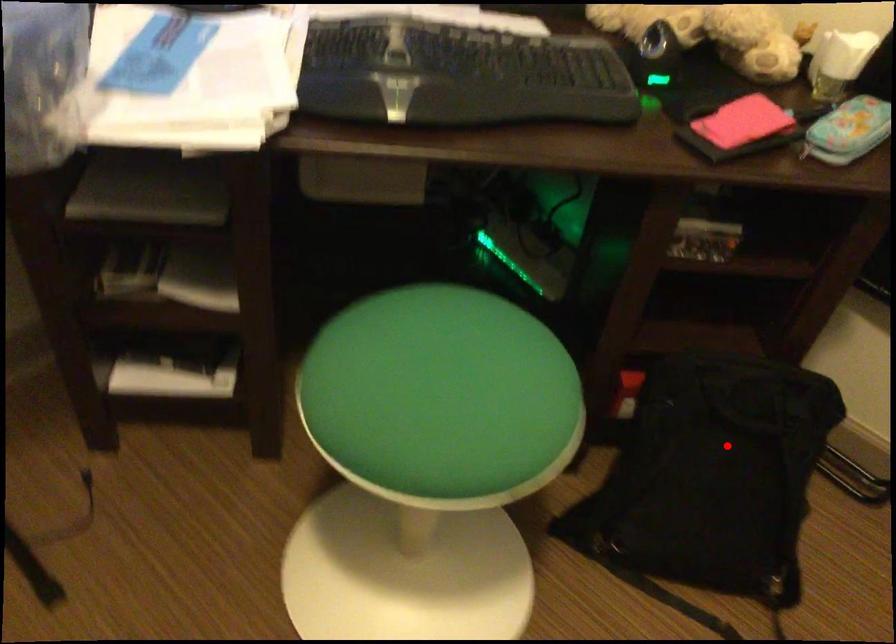
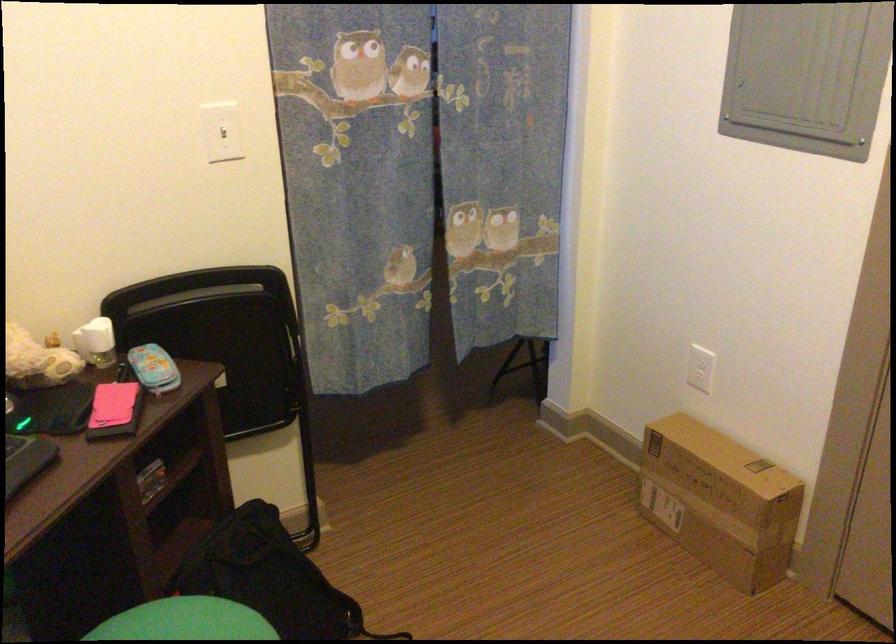
Question: I am providing you with two images of the same scene from different viewpoints. In image1, a red point is highlighted. Considering the same 3D point in image2, which of the following is correct?

Choices:
 (A) It is closer
 (B) It is farther

Answer: (B)